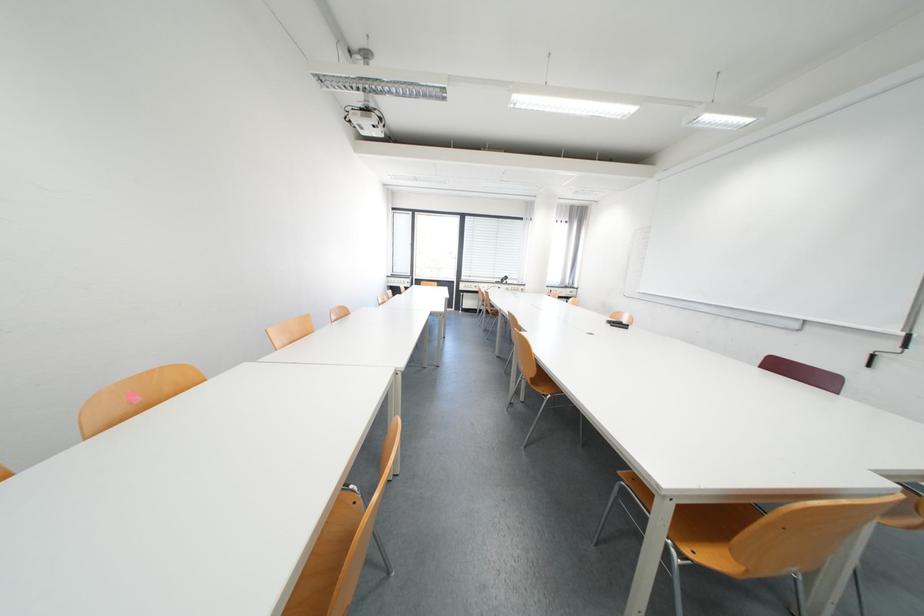
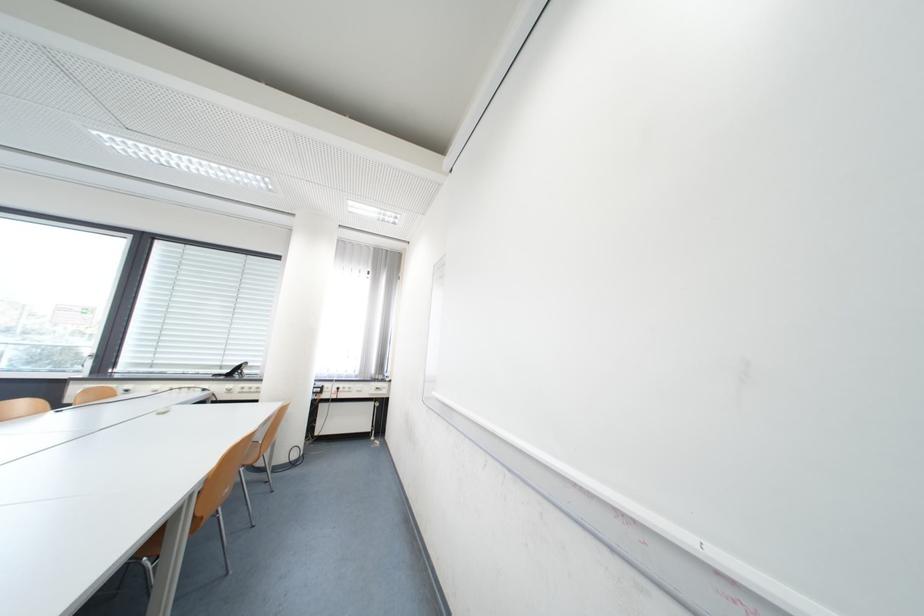
In the scene shown: In a continuous first-person perspective shot, in which direction is the camera moving?

The cameraman moved toward right, forward.